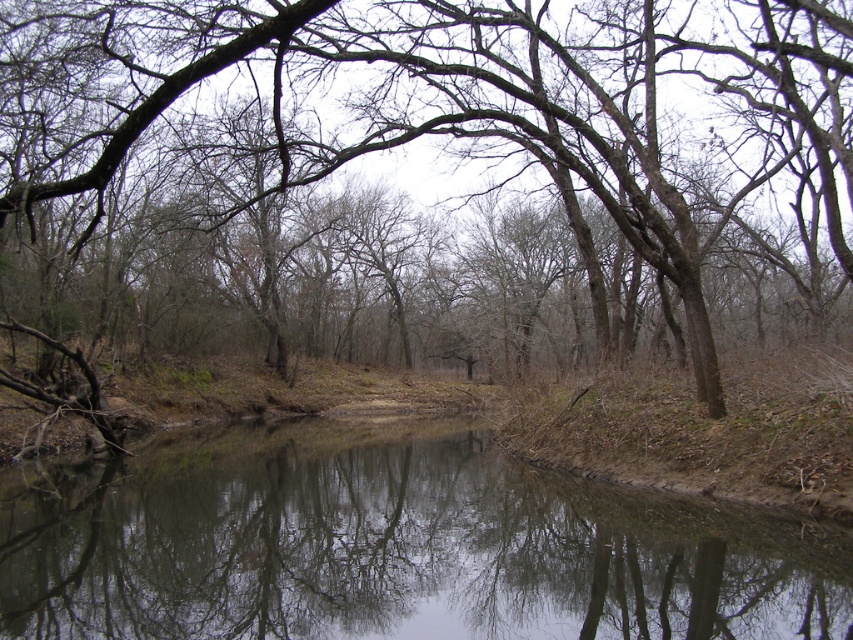
Based on the photo, you are standing at the edge of the water and want to place a small wooden bench between the brown rough tree at center and the clear water at center. Which object should you place the bench closer to so that it doesn

The brown rough tree at center is wider than the clear water at center, so you should place the bench closer to the clear water at center to ensure there is enough space between them.

You are standing at the origin point of the coordinate system in the scene. Based on the coordinates provided, can you determine the direction of the brown rough tree at center relative to your position?

The brown rough tree at center is located at coordinates point (404, 145), which means it is to the right and above your current position at the origin point.

You are standing at the edge of the water and want to see the reflection of the brown rough tree at center in the clear water at center. Will the entire tree be visible in the reflection?

The brown rough tree at center is taller than clear water at center, so its reflection in the clear water at center will not show the entire tree. Only the part of the tree that is as tall as the water surface will be reflected.